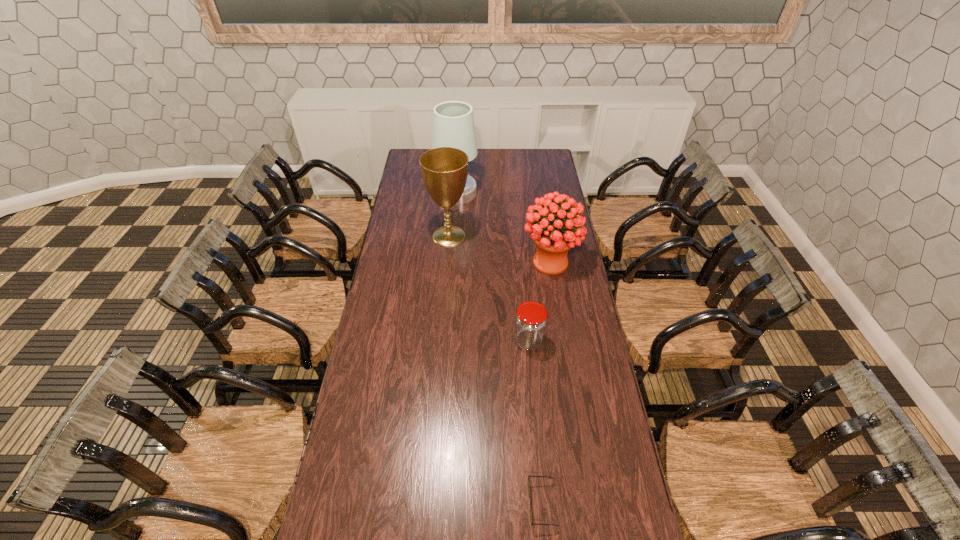
You are a GUI agent. You are given a task and a screenshot of the screen. Output one action in this format:
    pyautogui.click(x=<x>, y=<y>)
    Task: Click on the object that is the nearest to the lampshade
    This screenshot has width=960, height=540.
    Given the screenshot: What is the action you would take?
    pyautogui.click(x=444, y=170)

At what (x,y) coordinates should I click in order to perform the action: click on vacant region that satisfies the following two spatial constraints: 1. on the front side of the jar; 2. on the front-facing side of the sunglasses. Please return your answer as a coordinate pair (x, y). Image resolution: width=960 pixels, height=540 pixels. Looking at the image, I should click on click(544, 504).

Locate an element on the screen. The image size is (960, 540). vacant space that satisfies the following two spatial constraints: 1. on the back side of the bouquet; 2. on the right side of the jar is located at coordinates (521, 262).

I want to click on free space that satisfies the following two spatial constraints: 1. on the base of the lampshade; 2. on the front side of the trophy cup, so click(454, 236).

Where is `blank space that satisfies the following two spatial constraints: 1. on the base of the farthest object; 2. on the left side of the bouquet`? Image resolution: width=960 pixels, height=540 pixels. blank space that satisfies the following two spatial constraints: 1. on the base of the farthest object; 2. on the left side of the bouquet is located at coordinates (452, 262).